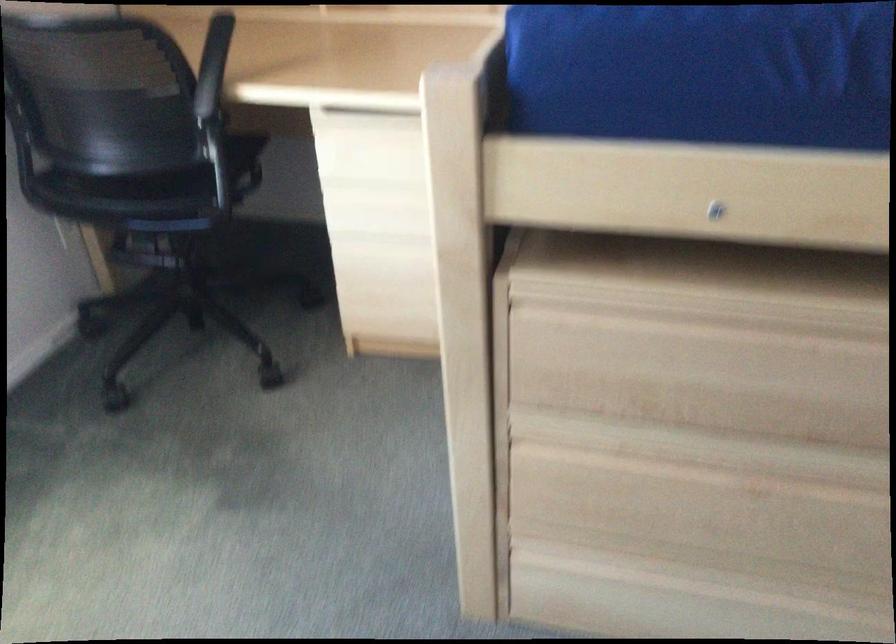
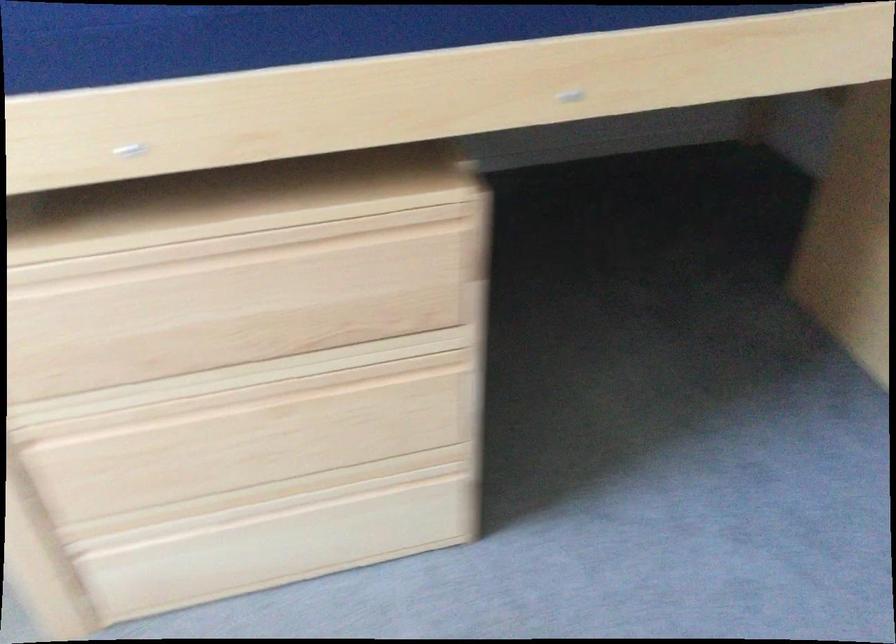
Question: In a continuous first-person perspective shot, in which direction is the camera moving?

Choices:
 (A) Left
 (B) Right
 (C) Forward
 (D) Backward

Answer: (B)